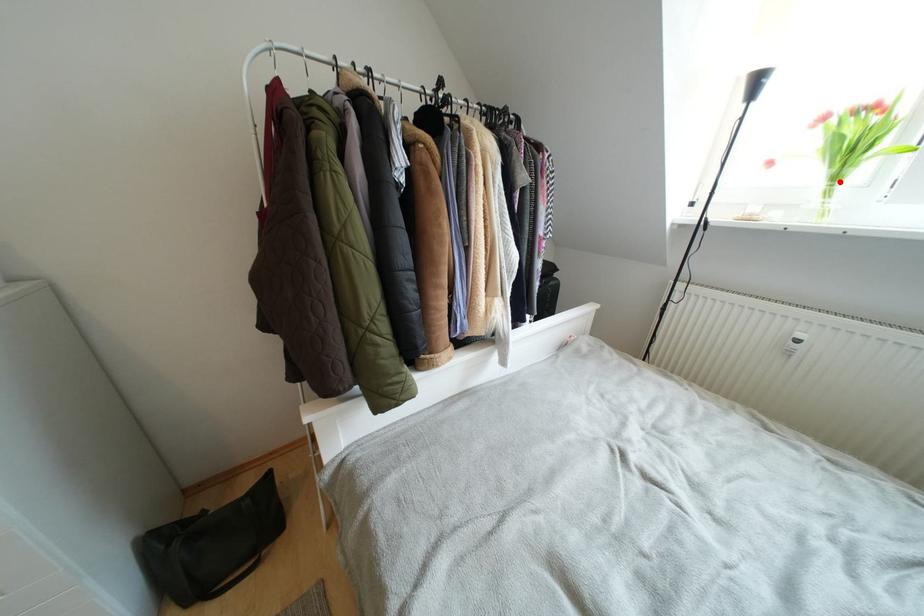
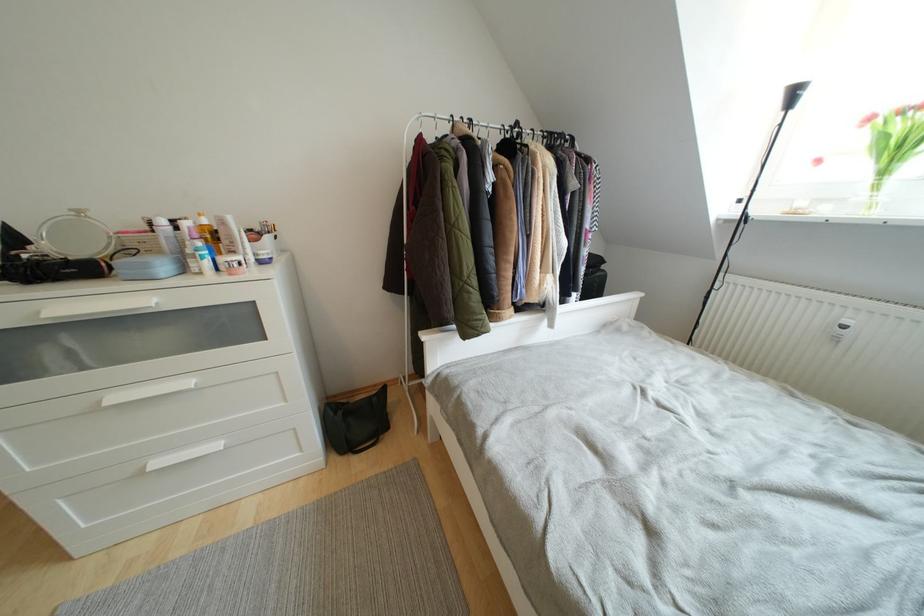
Find the pixel in the second image that matches the highlighted location in the first image.

(890, 176)